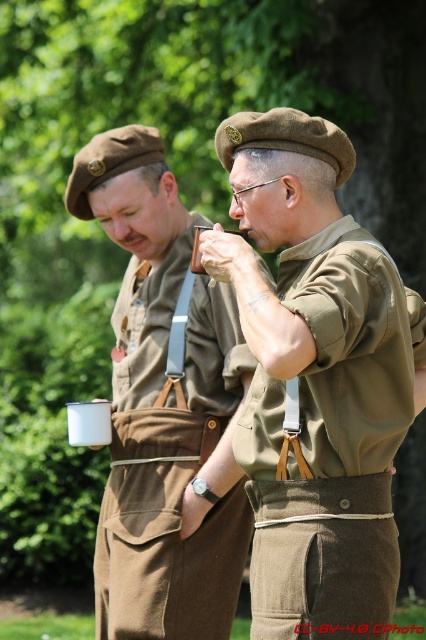
Between matte khaki shirt at center and matte brown uniform at center, which one appears on the left side from the viewer's perspective?

Positioned to the left is matte brown uniform at center.

Which is behind, point (383, 593) or point (199, 612)?

The point (199, 612) is behind.

Locate an element on the screen. The image size is (426, 640). matte khaki shirt at center is located at coordinates (331, 444).